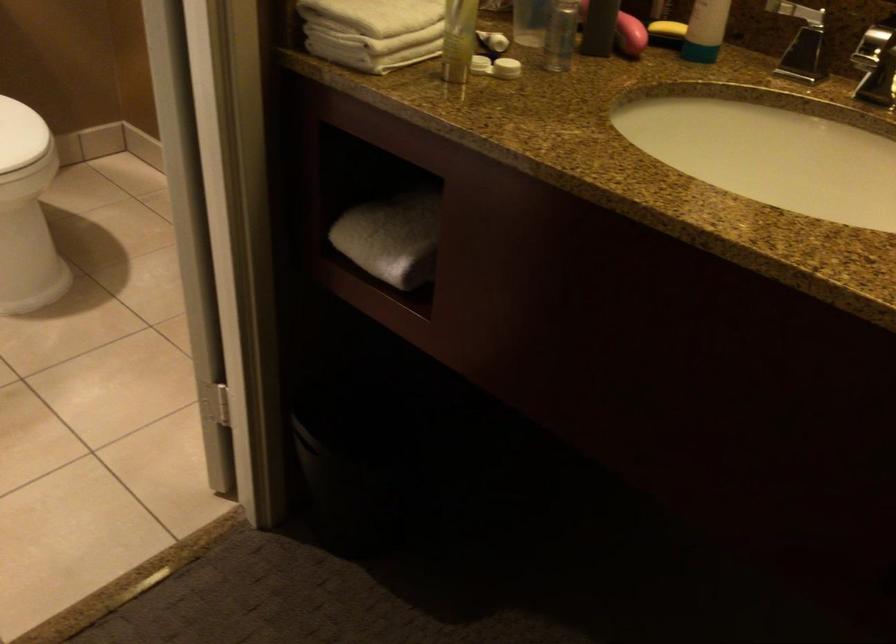
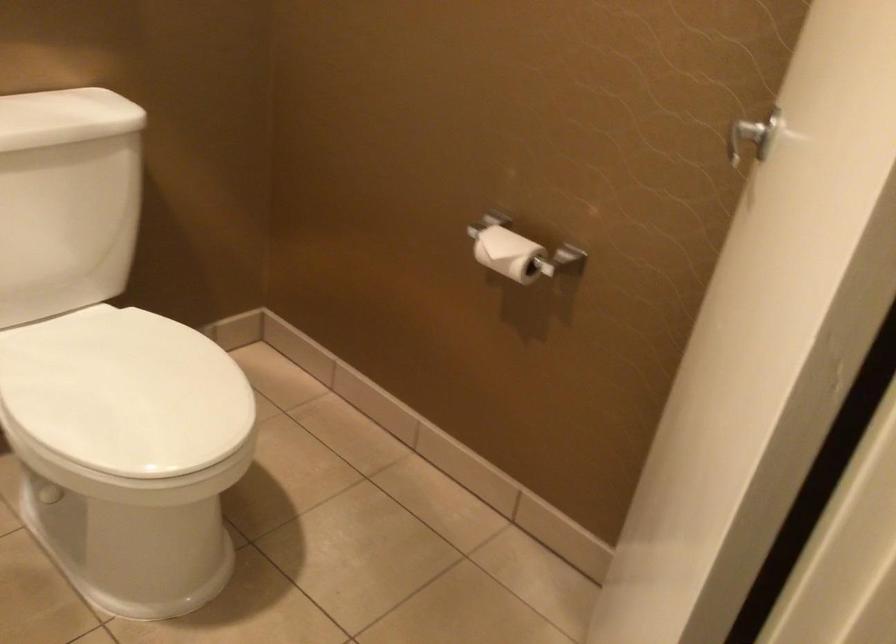
The images are taken continuously from a first-person perspective. In which direction are you moving?

The cameraman walked toward left, forward.